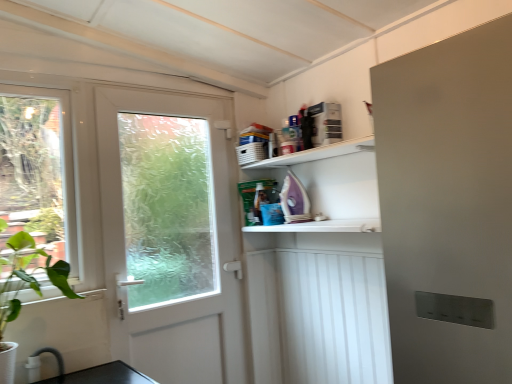
You are a GUI agent. You are given a task and a screenshot of the screen. Output one action in this format:
    pyautogui.click(x=<x>, y=<y>)
    Task: Click on the white matte door at left
    The image size is (512, 384).
    Given the screenshot: What is the action you would take?
    pyautogui.click(x=172, y=233)

Describe the element at coordinates (172, 233) in the screenshot. I see `white matte door at left` at that location.

I want to click on white matte door at left, so click(x=172, y=233).